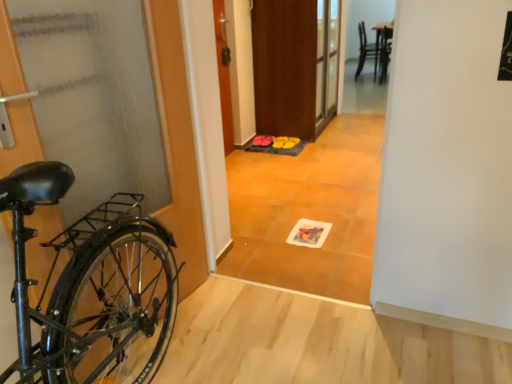
Question: Does wooden door at center, which is the 2th door from bottom to top, have a greater width compared to wooden chair at upper right?

Choices:
 (A) no
 (B) yes

Answer: (A)

Question: From a real-world perspective, is wooden door at center, which is the 1th door from back to front, positioned under wooden chair at upper right based on gravity?

Choices:
 (A) no
 (B) yes

Answer: (A)

Question: Can you confirm if wooden door at center, which is the 1th door from back to front, is positioned to the right of wooden chair at upper right?

Choices:
 (A) no
 (B) yes

Answer: (A)

Question: Is wooden door at center, arranged as the second door when viewed from the front, far from wooden chair at upper right?

Choices:
 (A) no
 (B) yes

Answer: (B)

Question: Is wooden door at center, which is the 2th door from bottom to top, completely or partially outside of wooden chair at upper right?

Choices:
 (A) no
 (B) yes

Answer: (B)

Question: Can you confirm if wooden door at center, which is the 1th door from back to front, is shorter than wooden chair at upper right?

Choices:
 (A) no
 (B) yes

Answer: (A)

Question: From a real-world perspective, is brown wooden screen door at center located higher than matte orange floor mat at center?

Choices:
 (A) no
 (B) yes

Answer: (A)

Question: Does brown wooden screen door at center have a greater width compared to matte orange floor mat at center?

Choices:
 (A) yes
 (B) no

Answer: (A)

Question: Is brown wooden screen door at center in front of matte orange floor mat at center?

Choices:
 (A) yes
 (B) no

Answer: (B)

Question: Is matte orange floor mat at center surrounded by brown wooden screen door at center?

Choices:
 (A) yes
 (B) no

Answer: (B)

Question: From the image's perspective, is brown wooden screen door at center above matte orange floor mat at center?

Choices:
 (A) no
 (B) yes

Answer: (B)

Question: From the image's perspective, is brown wooden screen door at center beneath matte orange floor mat at center?

Choices:
 (A) no
 (B) yes

Answer: (A)

Question: From a real-world perspective, is matte orange floor mat at center below wooden door at center, the first door when ordered from top to bottom?

Choices:
 (A) yes
 (B) no

Answer: (B)